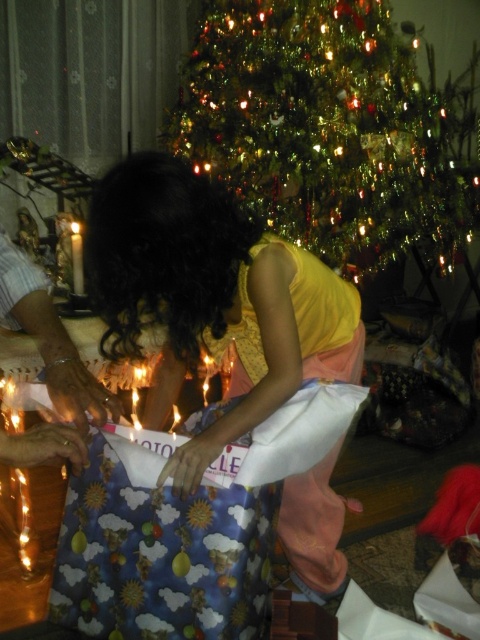
Which is below, matte yellow shirt at center or white wax candle at center?

matte yellow shirt at center is lower down.

Does point (244, 307) come closer to viewer compared to point (79, 294)?

Yes, point (244, 307) is in front of point (79, 294).

What are the coordinates of `matte yellow shirt at center` in the screenshot? It's located at (213, 300).

Is the position of green shiny christmas tree at upper center less distant than that of matte yellow shirt at center?

That is False.

Does green shiny christmas tree at upper center have a lesser width compared to matte yellow shirt at center?

In fact, green shiny christmas tree at upper center might be wider than matte yellow shirt at center.

Who is more distant from viewer, (333,113) or (88,252)?

The point (333,113) is more distant.

Where is `green shiny christmas tree at upper center`? green shiny christmas tree at upper center is located at coordinates (332, 128).

Does green shiny christmas tree at upper center have a larger size compared to white wax candle at center?

Yes.

Who is positioned more to the right, green shiny christmas tree at upper center or white wax candle at center?

green shiny christmas tree at upper center is more to the right.

Where is `green shiny christmas tree at upper center`? The width and height of the screenshot is (480, 640). green shiny christmas tree at upper center is located at coordinates (332, 128).